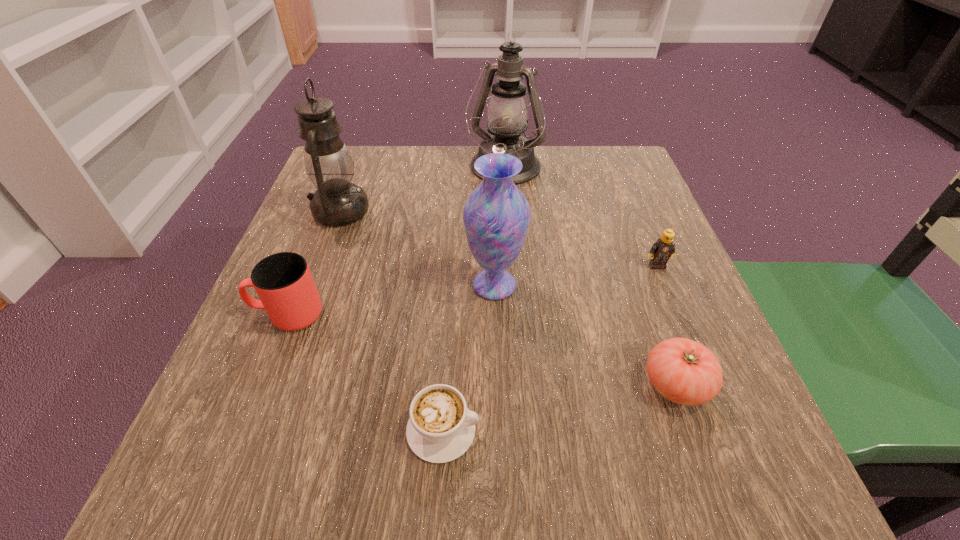
Locate an element on the screen. The width and height of the screenshot is (960, 540). free space between the right oil lamp and the Lego is located at coordinates (581, 218).

The image size is (960, 540). In order to click on blank region between the vase and the tomato in this screenshot , I will do `click(586, 335)`.

You are a GUI agent. You are given a task and a screenshot of the screen. Output one action in this format:
    pyautogui.click(x=<x>, y=<y>)
    Task: Click on the blank region between the vase and the tomato
    This screenshot has width=960, height=540.
    Given the screenshot: What is the action you would take?
    pyautogui.click(x=586, y=335)

The width and height of the screenshot is (960, 540). I want to click on object that stands as the closest to the Lego, so click(686, 372).

Where is `object that is the third closest to the tomato`? This screenshot has width=960, height=540. object that is the third closest to the tomato is located at coordinates (441, 428).

At what (x,y) coordinates should I click in order to perform the action: click on vacant space that satisfies the following two spatial constraints: 1. on the front side of the tomato; 2. on the left side of the vase. Please return your answer as a coordinate pair (x, y). The height and width of the screenshot is (540, 960). Looking at the image, I should click on (497, 384).

This screenshot has width=960, height=540. Find the location of `vacant space that satisfies the following two spatial constraints: 1. on the handle side of the fourth tallest object; 2. on the back side of the right oil lamp`. vacant space that satisfies the following two spatial constraints: 1. on the handle side of the fourth tallest object; 2. on the back side of the right oil lamp is located at coordinates (347, 169).

Find the location of a particular element. Image resolution: width=960 pixels, height=540 pixels. free region that satisfies the following two spatial constraints: 1. in front of the Lego; 2. to the right of the shortest object's handle is located at coordinates (724, 430).

Find the location of `free spot that satisfies the following two spatial constraints: 1. on the handle side of the vase; 2. on the left side of the fourth shortest object`. free spot that satisfies the following two spatial constraints: 1. on the handle side of the vase; 2. on the left side of the fourth shortest object is located at coordinates (300, 285).

Find the location of a particular element. free location that satisfies the following two spatial constraints: 1. on the front side of the vase; 2. to the right of the shortest object's handle is located at coordinates (499, 430).